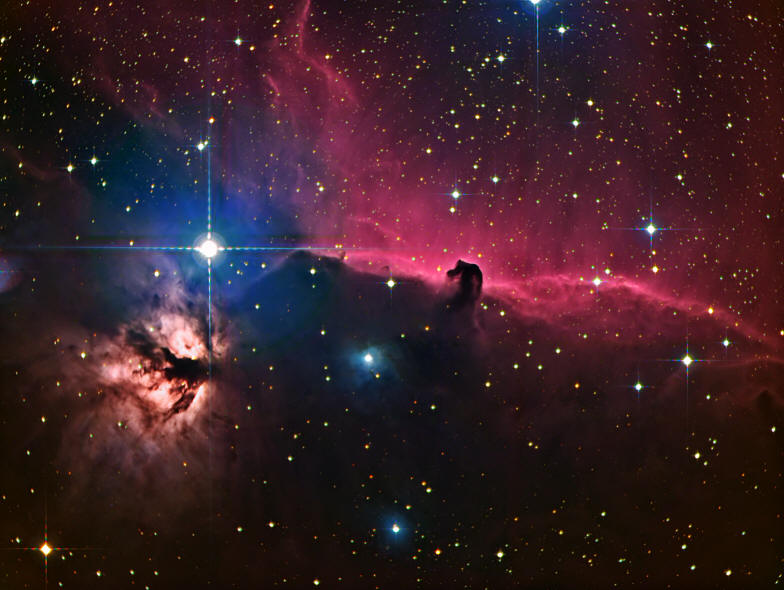
Where is `small lights positions`? This screenshot has height=590, width=784. small lights positions is located at coordinates (505, 540), (485, 114), (74, 114).